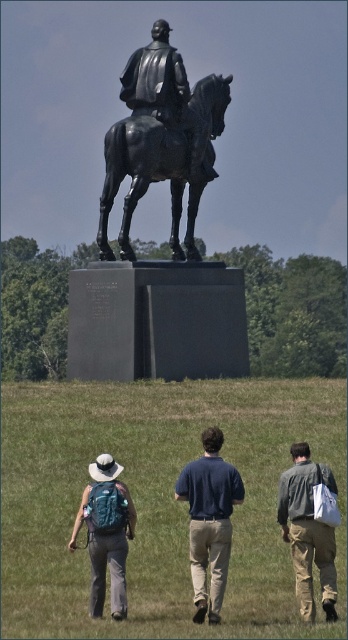
You are standing at the base of the equestrian statue and see the green grass at lower center and the teal fabric backpack at lower left. Which object is closer to your viewpoint?

The teal fabric backpack at lower left is closer to your viewpoint because it is positioned below the green grass at lower center, which is above it.

You are standing in the foreground looking towards the statue. You see the green grass at lower center and the shiny black horse at center. Which object is located to the right of the other?

The green grass at lower center is to the right of the shiny black horse at center.